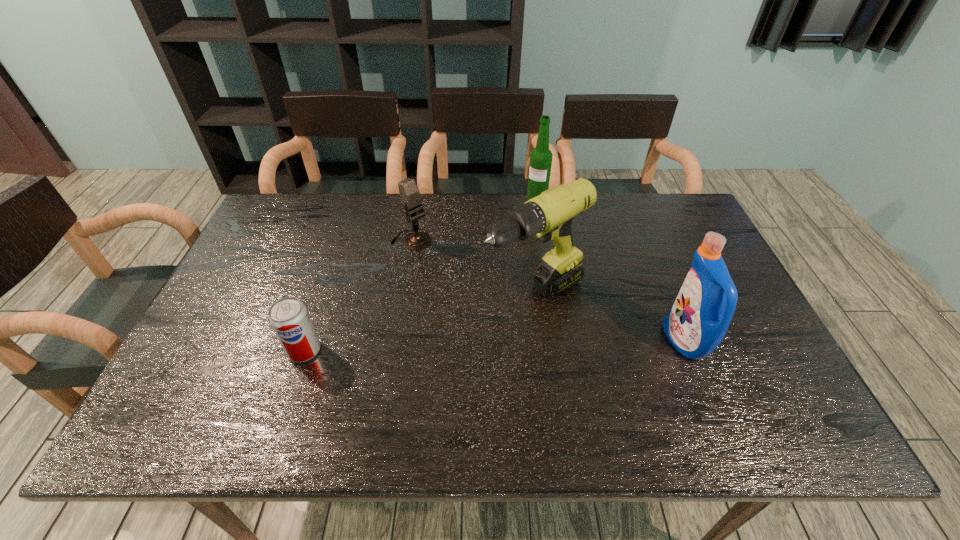
Locate an element on the screen. The width and height of the screenshot is (960, 540). vacant space in between the leftmost object and the drill is located at coordinates [420, 322].

Where is `vacant region between the drill and the fourth nearest object`? This screenshot has width=960, height=540. vacant region between the drill and the fourth nearest object is located at coordinates coord(473,267).

At what (x,y) coordinates should I click in order to perform the action: click on free space between the shortest object and the beer bottle. Please return your answer as a coordinate pair (x, y). The width and height of the screenshot is (960, 540). Looking at the image, I should click on (420, 274).

The image size is (960, 540). What are the coordinates of `vacant space that's between the detergent and the drill` in the screenshot? It's located at (610, 318).

Locate an element on the screen. The height and width of the screenshot is (540, 960). empty space that is in between the drill and the farthest object is located at coordinates click(x=536, y=247).

The height and width of the screenshot is (540, 960). I want to click on free space between the leftmost object and the farthest object, so click(420, 274).

This screenshot has width=960, height=540. What are the coordinates of `the closest object relative to the beer bottle` in the screenshot? It's located at (548, 216).

You are a GUI agent. You are given a task and a screenshot of the screen. Output one action in this format:
    pyautogui.click(x=<x>, y=<y>)
    Task: Click on the object that can be found as the second closest to the drill
    
    Given the screenshot: What is the action you would take?
    pyautogui.click(x=697, y=322)

Locate an element on the screen. free spot that satisfies the following two spatial constraints: 1. on the back side of the farthest object; 2. on the left side of the microphone is located at coordinates (419, 199).

You are a GUI agent. You are given a task and a screenshot of the screen. Output one action in this format:
    pyautogui.click(x=<x>, y=<y>)
    Task: Click on the vacant space that satisfies the following two spatial constraints: 1. on the back side of the farthest object; 2. on the right side of the shortest object
    
    Given the screenshot: What is the action you would take?
    pyautogui.click(x=356, y=199)